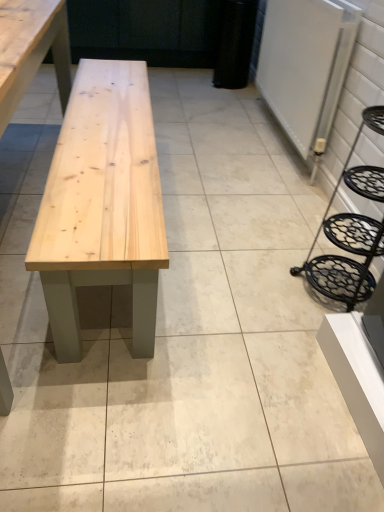
Find the location of a particular element. The image size is (384, 512). vacant space behind black wrought iron step stool at right is located at coordinates (302, 240).